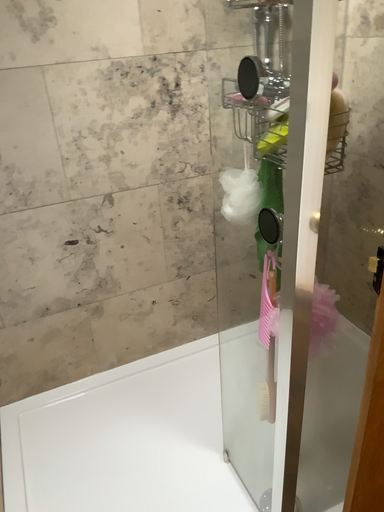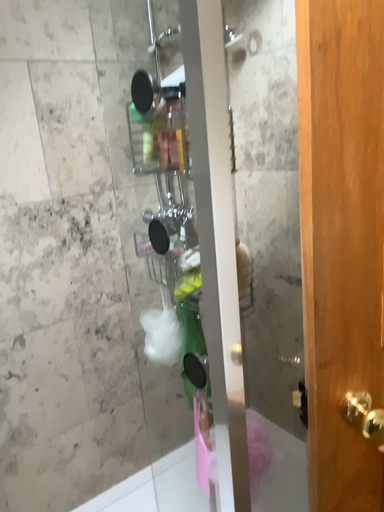
Question: How did the camera likely rotate when shooting the video?

Choices:
 (A) rotated downward
 (B) rotated upward

Answer: (B)